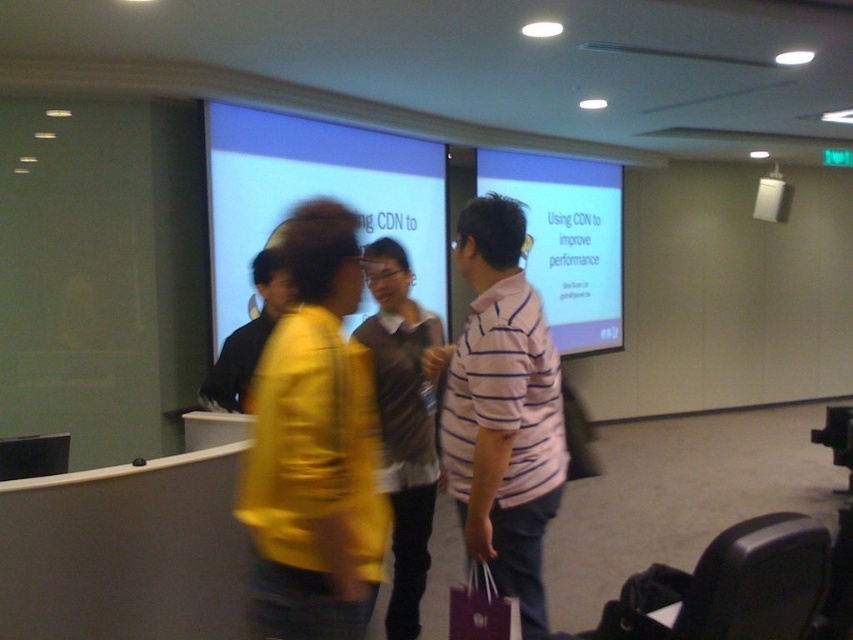
In the scene shown: Can you confirm if yellow shirt at center is taller than matte purple shopping bag at lower center?

Correct, yellow shirt at center is much taller as matte purple shopping bag at lower center.

Is point (268, 326) positioned in front of point (479, 605)?

No.

Locate an element on the screen. This screenshot has height=640, width=853. yellow shirt at center is located at coordinates (248, 337).

Does matte yellow jacket at center appear on the right side of pink striped shirt at center?

In fact, matte yellow jacket at center is to the left of pink striped shirt at center.

Is point (254, 636) positioned before point (524, 570)?

That is True.

Is point (296, 595) positioned in front of point (509, 211)?

Yes, point (296, 595) is closer to viewer.

Locate an element on the screen. matte yellow jacket at center is located at coordinates (314, 445).

Measure the distance between matte yellow jacket at center and camera.

matte yellow jacket at center is 4.77 feet from camera.

Which is in front, point (340, 529) or point (251, 369)?

Point (340, 529)

What do you see at coordinates (314, 445) in the screenshot? This screenshot has width=853, height=640. I see `matte yellow jacket at center` at bounding box center [314, 445].

Identify the location of matte yellow jacket at center. This screenshot has height=640, width=853. point(314,445).